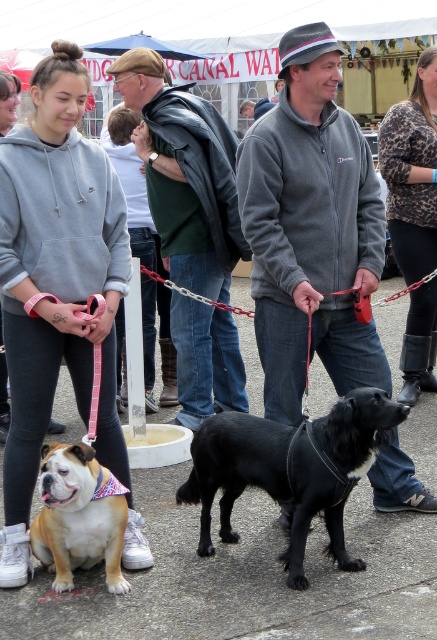
You are a photographer trying to capture a photo of both the gray fleece jacket at center and the black smooth dog at center. Since you want both subjects to be in focus, you need to adjust your camera settings. Considering their sizes, which subject should you focus on first to ensure proper depth of field?

The gray fleece jacket at center is taller than the black smooth dog at center, so you should focus on the taller subject first to ensure proper depth of field.

You are attending the CANAL WATER event and notice two attendees wearing similar clothing. You see a gray sweatshirt at upper left and a dark gray fleece at center. Which one is positioned more to the left?

The gray sweatshirt at upper left is positioned more to the left than the dark gray fleece at center.